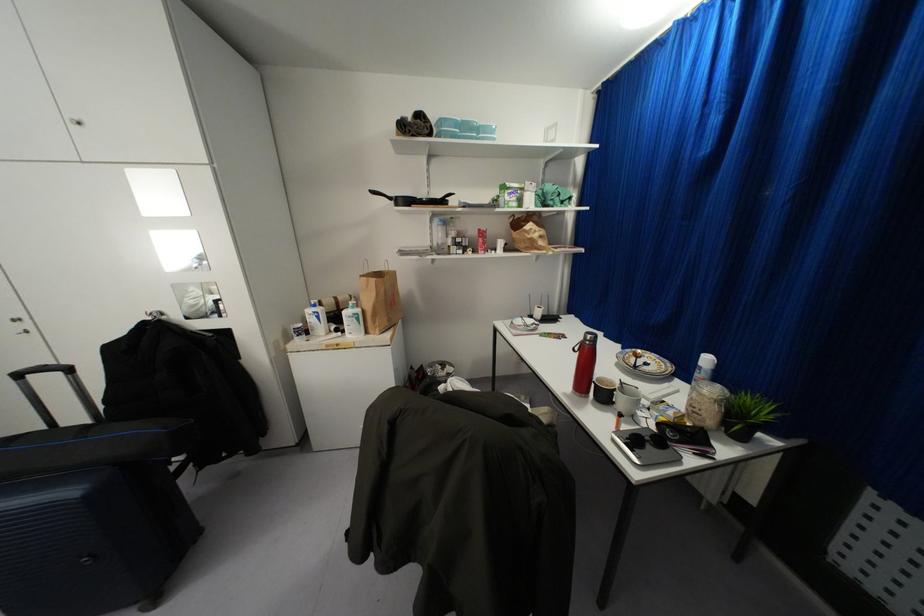
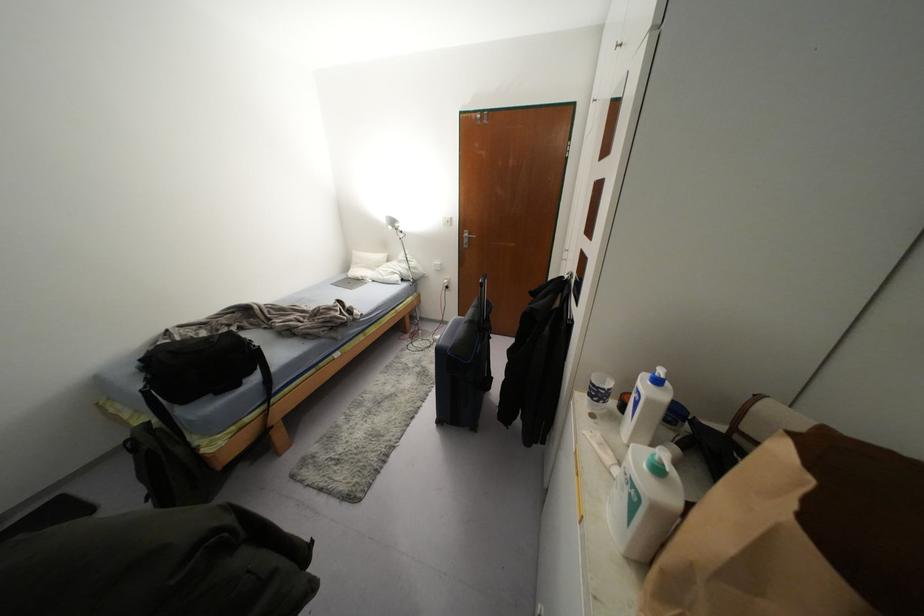
Find the pixel in the second image that matches [357,318] in the first image.

(633, 505)